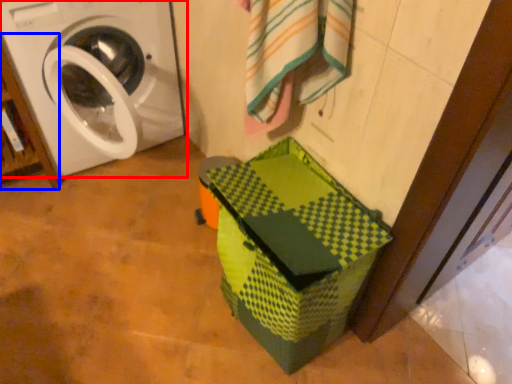
Question: Which object appears closest to the camera in this image, washing machine (highlighted by a red box) or shelf (highlighted by a blue box)?

Choices:
 (A) washing machine
 (B) shelf

Answer: (A)